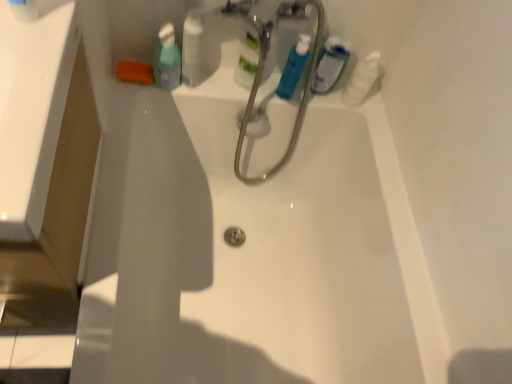
Question: From a real-world perspective, is white glossy bottle at upper center physically above blue glossy mouthwash at upper center, which appears as the second mouthwash when viewed from the right?

Choices:
 (A) yes
 (B) no

Answer: (A)

Question: Is white glossy bottle at upper center facing away from blue glossy mouthwash at upper center, the 2th mouthwash when ordered from left to right?

Choices:
 (A) no
 (B) yes

Answer: (A)

Question: Would you consider white glossy bottle at upper center to be distant from blue glossy mouthwash at upper center, which appears as the second mouthwash when viewed from the right?

Choices:
 (A) yes
 (B) no

Answer: (B)

Question: Is white glossy bottle at upper center in contact with blue glossy mouthwash at upper center, the 2th mouthwash when ordered from left to right?

Choices:
 (A) no
 (B) yes

Answer: (A)

Question: Is white glossy bottle at upper center thinner than blue glossy mouthwash at upper center, the 2th mouthwash when ordered from left to right?

Choices:
 (A) yes
 (B) no

Answer: (B)

Question: Does point (344, 92) appear closer or farther from the camera than point (194, 38)?

Choices:
 (A) closer
 (B) farther

Answer: (B)

Question: From their relative heights in the image, would you say white glossy bottle at upper right is taller or shorter than white glossy bottle at upper center?

Choices:
 (A) short
 (B) tall

Answer: (B)

Question: Would you say white glossy bottle at upper right is to the left or to the right of white glossy bottle at upper center in the picture?

Choices:
 (A) left
 (B) right

Answer: (B)

Question: Considering the positions of white glossy bottle at upper right and white glossy bottle at upper center in the image, is white glossy bottle at upper right wider or thinner than white glossy bottle at upper center?

Choices:
 (A) wide
 (B) thin

Answer: (A)

Question: Is blue glossy mouthwash at upper center, which appears as the second mouthwash when viewed from the right, to the left or to the right of white glossy bottle at upper right in the image?

Choices:
 (A) right
 (B) left

Answer: (B)

Question: Considering the positions of blue glossy mouthwash at upper center, which appears as the second mouthwash when viewed from the right, and white glossy bottle at upper right in the image, is blue glossy mouthwash at upper center, which appears as the second mouthwash when viewed from the right, taller or shorter than white glossy bottle at upper right?

Choices:
 (A) tall
 (B) short

Answer: (B)

Question: In terms of width, does blue glossy mouthwash at upper center, the 2th mouthwash when ordered from left to right, look wider or thinner when compared to white glossy bottle at upper right?

Choices:
 (A) thin
 (B) wide

Answer: (A)

Question: In the image, is blue glossy mouthwash at upper center, which appears as the second mouthwash when viewed from the right, positioned in front of or behind white glossy bottle at upper right?

Choices:
 (A) front
 (B) behind

Answer: (A)

Question: Based on their sizes in the image, would you say translucent plastic mouthwash at upper center, acting as the 1th mouthwash starting from the left, is bigger or smaller than blue glossy mouthwash at upper center, the 2th mouthwash when ordered from left to right?

Choices:
 (A) small
 (B) big

Answer: (B)

Question: From the image's perspective, is translucent plastic mouthwash at upper center, placed as the third mouthwash when sorted from right to left, above or below blue glossy mouthwash at upper center, which appears as the second mouthwash when viewed from the right?

Choices:
 (A) above
 (B) below

Answer: (A)